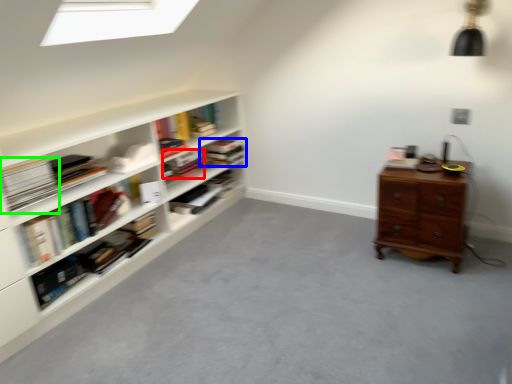
Question: Considering the real-world distances, which object is farthest from book (highlighted by a red box)? book (highlighted by a blue box) or paperback book (highlighted by a green box)?

Choices:
 (A) book
 (B) paperback book

Answer: (B)